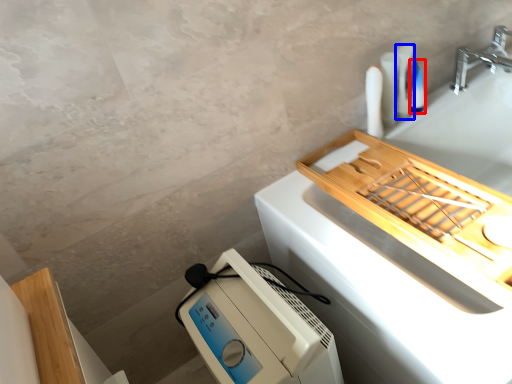
Question: Among these objects, which one is nearest to the camera, toiletry (highlighted by a red box) or toiletry (highlighted by a blue box)?

Choices:
 (A) toiletry
 (B) toiletry

Answer: (B)